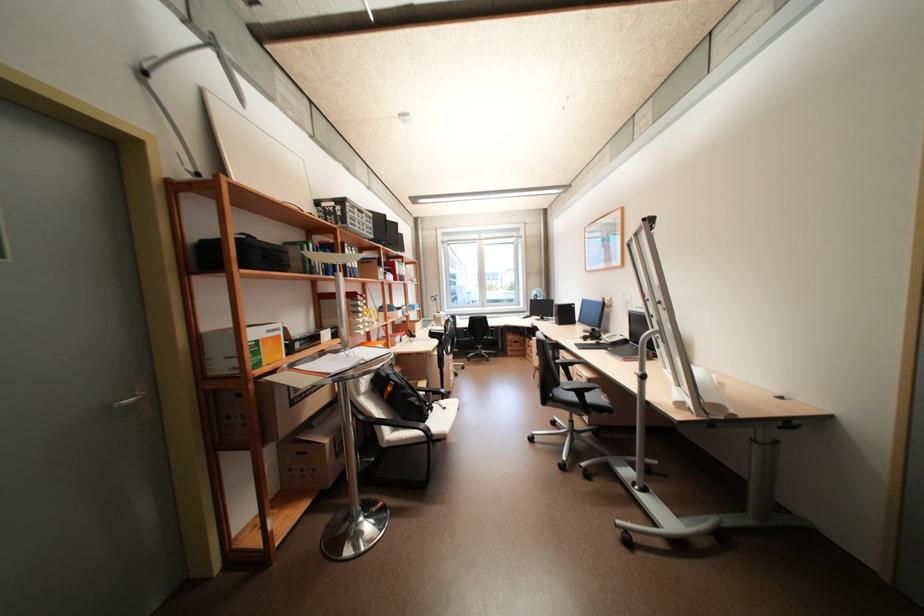
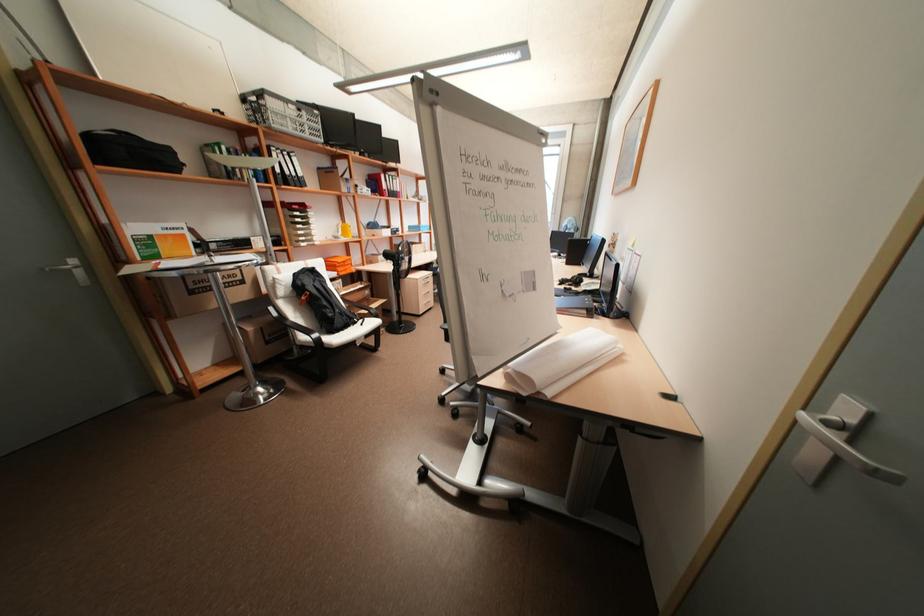
Find the pixel in the second image that matches (x=407, y=440) in the first image.

(311, 341)